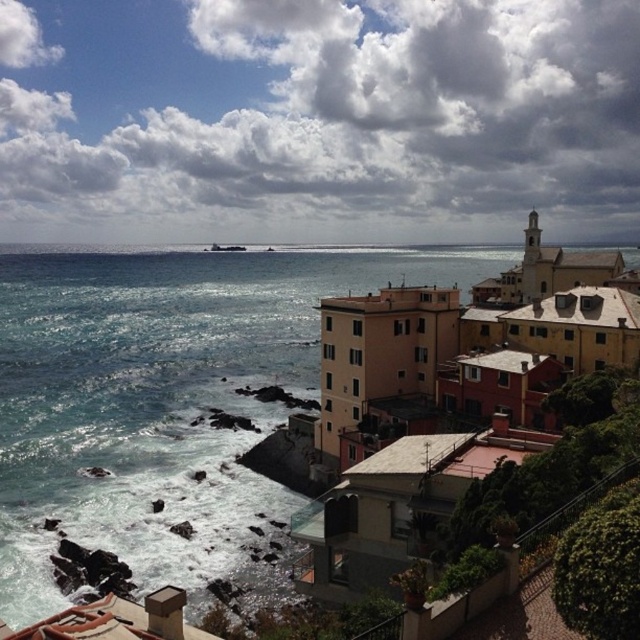
Where is `blue water at center`? This screenshot has height=640, width=640. blue water at center is located at coordinates (164, 401).

Does blue water at center appear on the right side of matte yellow building at center?

Incorrect, blue water at center is not on the right side of matte yellow building at center.

Between point (51, 403) and point (380, 408), which one is positioned in front?

Point (380, 408) is more forward.

I want to click on blue water at center, so click(164, 401).